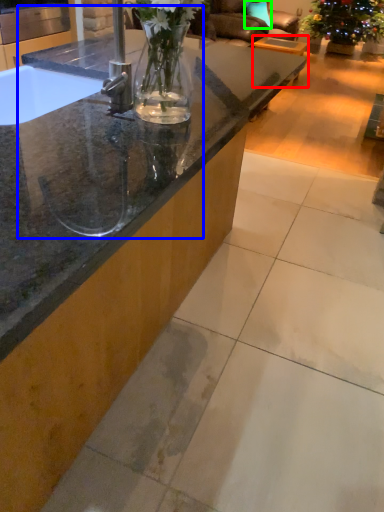
Question: Based on their relative distances, which object is nearer to table (highlighted by a red box)? Choose from sink (highlighted by a blue box) and pillow (highlighted by a green box).

Choices:
 (A) sink
 (B) pillow

Answer: (B)